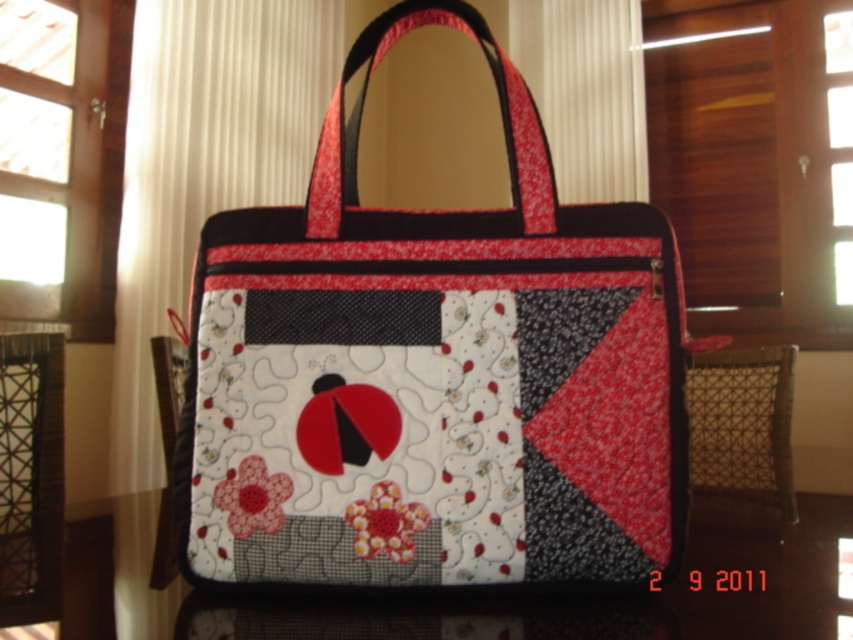
Who is positioned more to the right, quilted fabric bag at center or quilted fabric at center?

quilted fabric at center

Between point (445, 371) and point (445, 461), which one is positioned in front?

Point (445, 461)

Does point (666, 465) come farther from viewer compared to point (341, 364)?

Yes, it is.

You are a GUI agent. You are given a task and a screenshot of the screen. Output one action in this format:
    pyautogui.click(x=<x>, y=<y>)
    Task: Click on the quilted fabric bag at center
    The height and width of the screenshot is (640, 853).
    Given the screenshot: What is the action you would take?
    pyautogui.click(x=433, y=376)